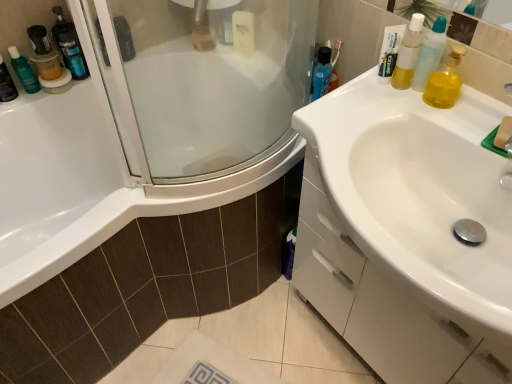
Identify the location of white glossy sink at right. The image size is (512, 384). (382, 305).

Describe the element at coordinates (408, 53) in the screenshot. The height and width of the screenshot is (384, 512). I see `translucent plastic mouthwash at upper right, the first mouthwash when ordered from front to back` at that location.

How much space does yellow translucent liquid at upper right, which is counted as the first toiletry, starting from the front, occupy vertically?

yellow translucent liquid at upper right, which is counted as the first toiletry, starting from the front, is 7.09 inches in height.

The width and height of the screenshot is (512, 384). Describe the element at coordinates (44, 54) in the screenshot. I see `translucent plastic mouthwash at upper left, the 4th mouthwash when ordered from front to back` at that location.

This screenshot has height=384, width=512. Describe the element at coordinates (322, 72) in the screenshot. I see `blue glossy mouthwash at upper right, arranged as the 3th mouthwash when viewed from the back` at that location.

At what (x,y) coordinates should I click in order to perform the action: click on white glossy sink at right. Please return your answer as a coordinate pair (x, y). Looking at the image, I should click on (382, 305).

Is white glossy sink at right bigger or smaller than translucent plastic container at upper left, the 2th toiletry viewed from the front?

Considering their sizes, white glossy sink at right takes up more space than translucent plastic container at upper left, the 2th toiletry viewed from the front.

Which of these two, white glossy sink at right or translucent plastic container at upper left, the 1th toiletry in the back-to-front sequence, stands taller?

Standing taller between the two is white glossy sink at right.

Considering the positions of objects white glossy sink at right and translucent plastic container at upper left, the 2th toiletry viewed from the front, in the image provided, who is more to the right, white glossy sink at right or translucent plastic container at upper left, the 2th toiletry viewed from the front,?

Positioned to the right is white glossy sink at right.

Does white glossy sink at right come behind translucent plastic container at upper left, the 1th toiletry in the back-to-front sequence?

No, the depth of white glossy sink at right is less than that of translucent plastic container at upper left, the 1th toiletry in the back-to-front sequence.

Can you tell me how much translucent plastic container at upper left, which appears as the second toiletry when viewed from the right, and translucent plastic mouthwash at upper right, which appears as the 4th mouthwash when viewed from the back, differ in facing direction?

84.6 degrees.

From the image's perspective, between translucent plastic container at upper left, the 2th toiletry viewed from the front, and translucent plastic mouthwash at upper right, which appears as the 4th mouthwash when viewed from the back, who is located below?

translucent plastic mouthwash at upper right, which appears as the 4th mouthwash when viewed from the back, from the image's perspective.

Looking at this image, from a real-world perspective, is translucent plastic container at upper left, the 1th toiletry in the back-to-front sequence, on translucent plastic mouthwash at upper right, which appears as the 4th mouthwash when viewed from the back?

Incorrect, from a real-world perspective, translucent plastic container at upper left, the 1th toiletry in the back-to-front sequence, is lower than translucent plastic mouthwash at upper right, which appears as the 4th mouthwash when viewed from the back.

Is translucent plastic container at upper left, the 1th toiletry in the back-to-front sequence, positioned with its back to translucent plastic mouthwash at upper right, which appears as the 4th mouthwash when viewed from the back?

No, translucent plastic container at upper left, the 1th toiletry in the back-to-front sequence, is not facing the opposite direction of translucent plastic mouthwash at upper right, which appears as the 4th mouthwash when viewed from the back.

Looking at this image, from a real-world perspective, who is located higher, blue glossy mouthwash at upper right, the second mouthwash positioned from the front, or translucent plastic mouthwash at upper left, the 4th mouthwash when ordered from front to back?

In real-world perspective, blue glossy mouthwash at upper right, the second mouthwash positioned from the front, is above.

Based on the photo, which object is positioned more to the left, blue glossy mouthwash at upper right, arranged as the 3th mouthwash when viewed from the back, or translucent plastic mouthwash at upper left, positioned as the second mouthwash in left-to-right order?

translucent plastic mouthwash at upper left, positioned as the second mouthwash in left-to-right order, is more to the left.

Where is `the 2nd mouthwash positioned above the translucent plastic mouthwash at upper left, the 4th mouthwash when ordered from front to back (from a real-world perspective)`? the 2nd mouthwash positioned above the translucent plastic mouthwash at upper left, the 4th mouthwash when ordered from front to back (from a real-world perspective) is located at coordinates (322, 72).

Does blue glossy mouthwash at upper right, positioned as the third mouthwash in left-to-right order, have a smaller size compared to translucent plastic mouthwash at upper left, the 4th mouthwash when ordered from front to back?

Indeed, blue glossy mouthwash at upper right, positioned as the third mouthwash in left-to-right order, has a smaller size compared to translucent plastic mouthwash at upper left, the 4th mouthwash when ordered from front to back.

Is translucent plastic container at upper left, the 2th toiletry viewed from the front, inside or outside of translucent plastic mouthwash at left, placed as the 4th mouthwash when sorted from right to left?

translucent plastic container at upper left, the 2th toiletry viewed from the front, exists outside the volume of translucent plastic mouthwash at left, placed as the 4th mouthwash when sorted from right to left.

Is translucent plastic container at upper left, which is counted as the 1th toiletry, starting from the left, at the right side of translucent plastic mouthwash at left, placed as the 4th mouthwash when sorted from right to left?

Yes.

Considering the points (15, 56) and (3, 62), which point is behind, point (15, 56) or point (3, 62)?

Positioned behind is point (15, 56).

Which object is more forward, translucent plastic container at upper left, which is counted as the 1th toiletry, starting from the left, or translucent plastic mouthwash at left, the 2th mouthwash viewed from the back?

translucent plastic mouthwash at left, the 2th mouthwash viewed from the back.

Who is bigger, translucent plastic bottle at upper left or blue glossy mouthwash at upper right, the second mouthwash positioned from the front?

translucent plastic bottle at upper left.

Is translucent plastic bottle at upper left further to the viewer compared to blue glossy mouthwash at upper right, positioned as the third mouthwash in left-to-right order?

Yes, it is behind blue glossy mouthwash at upper right, positioned as the third mouthwash in left-to-right order.

Is translucent plastic bottle at upper left taller than blue glossy mouthwash at upper right, positioned as the third mouthwash in left-to-right order?

Correct, translucent plastic bottle at upper left is much taller as blue glossy mouthwash at upper right, positioned as the third mouthwash in left-to-right order.

Can blue glossy mouthwash at upper right, arranged as the 3th mouthwash when viewed from the back, be found inside translucent plastic bottle at upper left?

Actually, blue glossy mouthwash at upper right, arranged as the 3th mouthwash when viewed from the back, is outside translucent plastic bottle at upper left.

From the image's perspective, is white glossy sink at right positioned above or below translucent plastic mouthwash at upper left, the 4th mouthwash when ordered from front to back?

Clearly, from the image's perspective, white glossy sink at right is below translucent plastic mouthwash at upper left, the 4th mouthwash when ordered from front to back.

Is white glossy sink at right oriented towards translucent plastic mouthwash at upper left, the 4th mouthwash when ordered from front to back?

No, white glossy sink at right does not turn towards translucent plastic mouthwash at upper left, the 4th mouthwash when ordered from front to back.

From the picture: Is the depth of white glossy sink at right greater than that of translucent plastic mouthwash at upper left, the 4th mouthwash when ordered from front to back?

That is False.

Is translucent plastic container at upper left, which appears as the second toiletry when viewed from the right, at the back of translucent plastic mouthwash at left, marked as the first mouthwash in a left-to-right arrangement?

translucent plastic mouthwash at left, marked as the first mouthwash in a left-to-right arrangement, is not turned away from translucent plastic container at upper left, which appears as the second toiletry when viewed from the right.

Is there a large distance between translucent plastic mouthwash at left, the 2th mouthwash viewed from the back, and translucent plastic container at upper left, the 1th toiletry in the back-to-front sequence?

That's not correct — translucent plastic mouthwash at left, the 2th mouthwash viewed from the back, is a little close to translucent plastic container at upper left, the 1th toiletry in the back-to-front sequence.

Is point (15, 98) in front of point (13, 67)?

No, (15, 98) is further to viewer.

Considering the sizes of translucent plastic mouthwash at left, placed as the 4th mouthwash when sorted from right to left, and translucent plastic container at upper left, which appears as the second toiletry when viewed from the right, in the image, is translucent plastic mouthwash at left, placed as the 4th mouthwash when sorted from right to left, taller or shorter than translucent plastic container at upper left, which appears as the second toiletry when viewed from the right,?

In the image, translucent plastic mouthwash at left, placed as the 4th mouthwash when sorted from right to left, appears to be taller than translucent plastic container at upper left, which appears as the second toiletry when viewed from the right.

From the white glossy sink at right, count the 2nd toiletry to the left and point to it. Please provide its 2D coordinates.

[(24, 71)]

Image resolution: width=512 pixels, height=384 pixels. Identify the location of mouthwash that is the 3rd one when counting rightward from the translucent plastic container at upper left, the 2th toiletry viewed from the front. (408, 53).

From the image, which object appears to be farther from translucent plastic mouthwash at upper left, positioned as the second mouthwash in left-to-right order, translucent plastic bottle at upper left or translucent plastic mouthwash at left, the 2th mouthwash viewed from the back?

translucent plastic mouthwash at left, the 2th mouthwash viewed from the back, is positioned further to the anchor translucent plastic mouthwash at upper left, positioned as the second mouthwash in left-to-right order.

Which object lies further to the anchor point translucent plastic container at upper left, the 2th toiletry viewed from the front, translucent plastic bottle at upper left or yellow translucent liquid at upper right, the second toiletry viewed from the back?

Based on the image, yellow translucent liquid at upper right, the second toiletry viewed from the back, appears to be further to translucent plastic container at upper left, the 2th toiletry viewed from the front.

Which object lies nearer to the anchor point white glossy sink at right, translucent plastic bottle at upper left or translucent plastic mouthwash at upper right, which is the first mouthwash in right-to-left order?

Among the two, translucent plastic mouthwash at upper right, which is the first mouthwash in right-to-left order, is located nearer to white glossy sink at right.

Looking at the image, which one is located closer to translucent plastic mouthwash at upper left, arranged as the first mouthwash when viewed from the back, translucent plastic container at upper left, the 1th toiletry in the back-to-front sequence, or translucent plastic mouthwash at upper right, which ranks as the fourth mouthwash in left-to-right order?

translucent plastic container at upper left, the 1th toiletry in the back-to-front sequence, is closer to translucent plastic mouthwash at upper left, arranged as the first mouthwash when viewed from the back.

Looking at the image, which one is located further to translucent plastic bottle at upper left, white glossy sink at right or translucent plastic mouthwash at upper right, which appears as the 4th mouthwash when viewed from the back?

white glossy sink at right.

Which object lies further to the anchor point translucent plastic mouthwash at upper left, arranged as the first mouthwash when viewed from the back, translucent plastic mouthwash at left, placed as the 4th mouthwash when sorted from right to left, or translucent plastic bottle at upper left?

Among the two, translucent plastic mouthwash at left, placed as the 4th mouthwash when sorted from right to left, is located further to translucent plastic mouthwash at upper left, arranged as the first mouthwash when viewed from the back.

Considering their positions, is translucent plastic container at upper left, the 1th toiletry in the back-to-front sequence, positioned closer to translucent plastic bottle at upper left than yellow translucent liquid at upper right, which is counted as the first toiletry, starting from the front?

translucent plastic container at upper left, the 1th toiletry in the back-to-front sequence.

Consider the image. Considering their positions, is translucent plastic mouthwash at left, the 2th mouthwash viewed from the back, positioned closer to white glossy sink at right than translucent plastic mouthwash at upper right, which appears as the 4th mouthwash when viewed from the back?

translucent plastic mouthwash at upper right, which appears as the 4th mouthwash when viewed from the back, lies closer to white glossy sink at right than the other object.

What are the coordinates of `mouthwash between translucent plastic mouthwash at left, the 2th mouthwash viewed from the back, and translucent plastic bottle at upper left, in the horizontal direction` in the screenshot? It's located at (44, 54).

The image size is (512, 384). Find the location of `mouthwash situated between translucent plastic mouthwash at upper left, arranged as the first mouthwash when viewed from the back, and translucent plastic mouthwash at upper right, which is the first mouthwash in right-to-left order, from left to right`. mouthwash situated between translucent plastic mouthwash at upper left, arranged as the first mouthwash when viewed from the back, and translucent plastic mouthwash at upper right, which is the first mouthwash in right-to-left order, from left to right is located at coordinates (322, 72).

Where is `cleaning product situated between translucent plastic container at upper left, which appears as the second toiletry when viewed from the right, and blue glossy mouthwash at upper right, placed as the second mouthwash when sorted from right to left, from left to right`? The height and width of the screenshot is (384, 512). cleaning product situated between translucent plastic container at upper left, which appears as the second toiletry when viewed from the right, and blue glossy mouthwash at upper right, placed as the second mouthwash when sorted from right to left, from left to right is located at coordinates (69, 45).

Where is `cleaning product located between translucent plastic mouthwash at upper left, positioned as the second mouthwash in left-to-right order, and blue glossy mouthwash at upper right, the second mouthwash positioned from the front, in the left-right direction`? cleaning product located between translucent plastic mouthwash at upper left, positioned as the second mouthwash in left-to-right order, and blue glossy mouthwash at upper right, the second mouthwash positioned from the front, in the left-right direction is located at coordinates (69, 45).